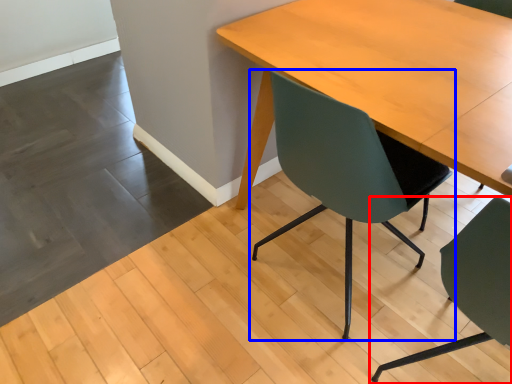
Question: Which point is closer to the camera, chair (highlighted by a red box) or chair (highlighted by a blue box)?

Choices:
 (A) chair
 (B) chair

Answer: (A)